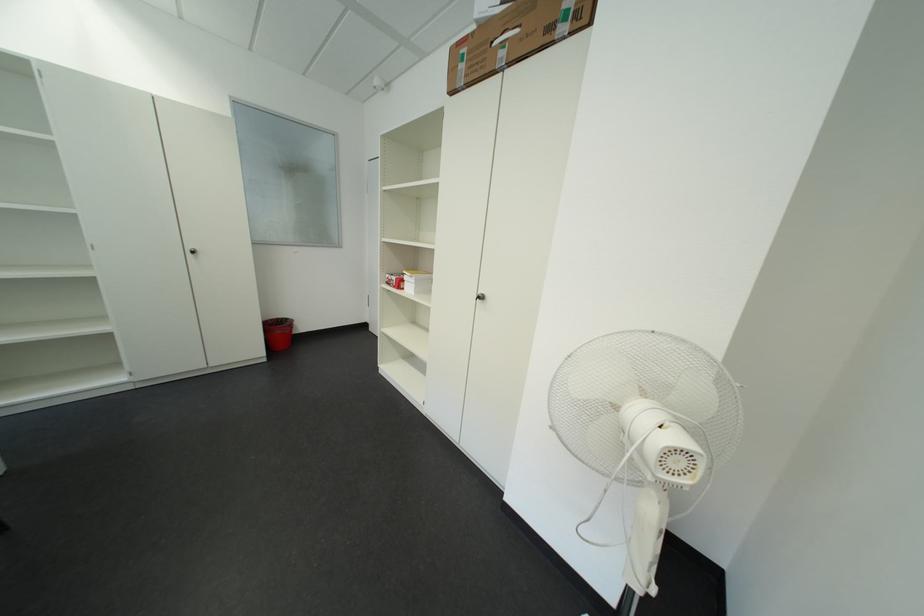
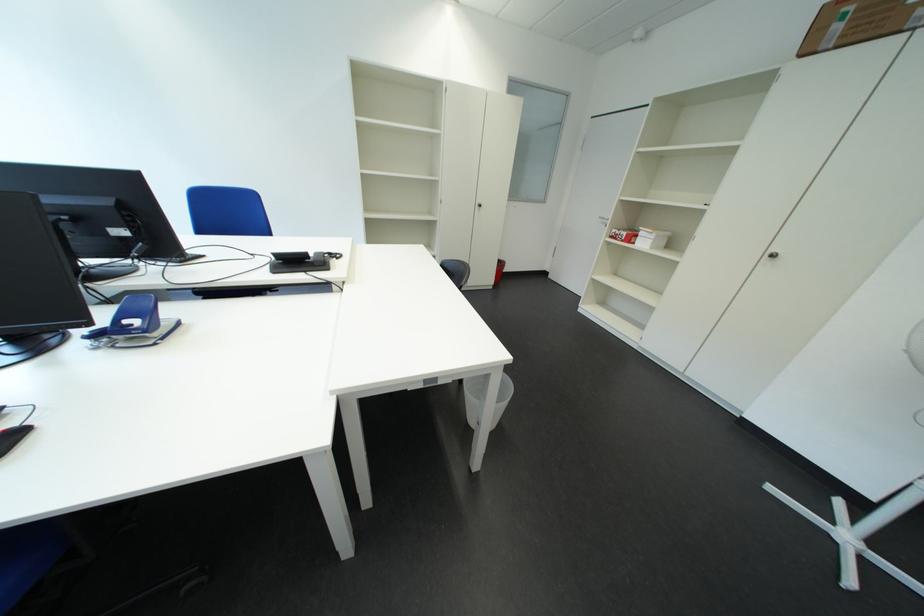
The point at [407,281] is marked in the first image. Where is the corresponding point in the second image?

(637, 236)